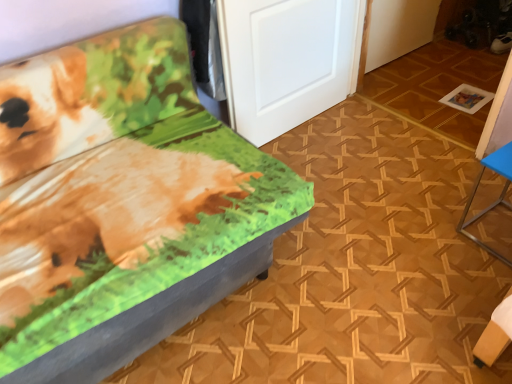
Question: From a real-world perspective, does white matte door at center sit lower than printed fabric bench at left, which is the 2th furniture in right-to-left order?

Choices:
 (A) yes
 (B) no

Answer: (B)

Question: Is white matte door at center bigger than printed fabric bench at left, which is the 2th furniture in right-to-left order?

Choices:
 (A) no
 (B) yes

Answer: (A)

Question: Does white matte door at center lie behind printed fabric bench at left, which is the 2th furniture in right-to-left order?

Choices:
 (A) no
 (B) yes

Answer: (B)

Question: Does white matte door at center have a lesser width compared to printed fabric bench at left, the first furniture from the left?

Choices:
 (A) no
 (B) yes

Answer: (B)

Question: Does white matte door at center have a lesser height compared to printed fabric bench at left, the first furniture from the left?

Choices:
 (A) no
 (B) yes

Answer: (A)

Question: From the image's perspective, is white matte door at center below printed fabric bench at left, which is the 2th furniture in right-to-left order?

Choices:
 (A) yes
 (B) no

Answer: (B)

Question: Is the depth of printed fabric bench at left, the first furniture from the left, greater than that of white matte door at center?

Choices:
 (A) yes
 (B) no

Answer: (B)

Question: From the image's perspective, is printed fabric bench at left, which is the 2th furniture in right-to-left order, below white matte door at center?

Choices:
 (A) yes
 (B) no

Answer: (A)

Question: Are printed fabric bench at left, which is the 2th furniture in right-to-left order, and white matte door at center far apart?

Choices:
 (A) yes
 (B) no

Answer: (B)

Question: Is printed fabric bench at left, the first furniture from the left, smaller than white matte door at center?

Choices:
 (A) yes
 (B) no

Answer: (B)

Question: Considering the relative sizes of printed fabric bench at left, the first furniture from the left, and white matte door at center in the image provided, is printed fabric bench at left, the first furniture from the left, shorter than white matte door at center?

Choices:
 (A) yes
 (B) no

Answer: (A)

Question: Is printed fabric bench at left, which is the 2th furniture in right-to-left order, at the right side of white matte door at center?

Choices:
 (A) no
 (B) yes

Answer: (A)

Question: Can you confirm if blue metallic table at right, which is the 2th furniture from left to right, is wider than printed fabric bench at left, the first furniture from the left?

Choices:
 (A) no
 (B) yes

Answer: (A)